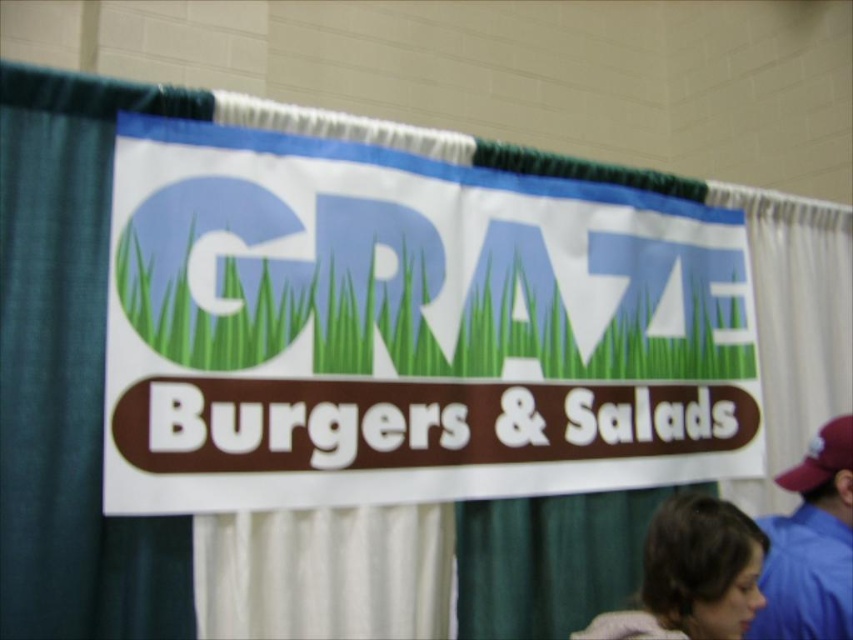
You are standing in front of the Grate Burgers banner and see two points marked on the banner. Which point is closer to you, point (706, 497) or point (833, 592)?

Point (706, 497) is closer to the viewer than point (833, 592).

You are a customer at the event and want to read the details on the white paper sign at center and the brown hair at lower right. Which object is taller?

The white paper sign at center is much taller than the brown hair at lower right.